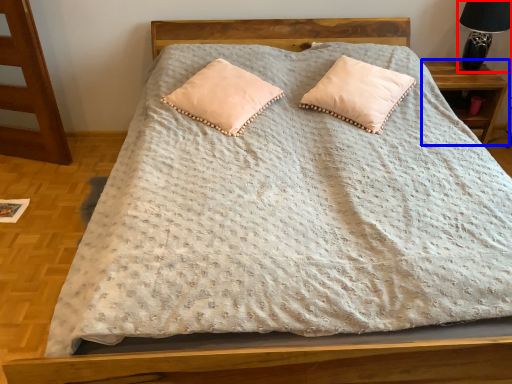
Question: Which object appears farthest to the camera in this image, table lamp (highlighted by a red box) or nightstand (highlighted by a blue box)?

Choices:
 (A) table lamp
 (B) nightstand

Answer: (B)